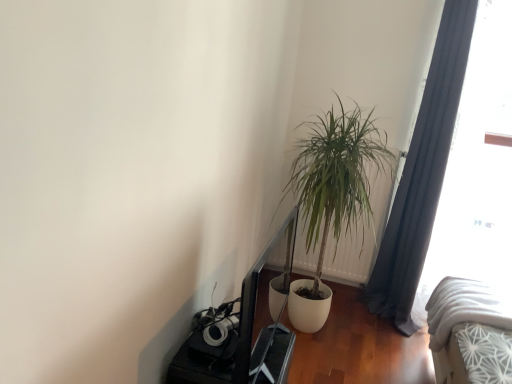
Question: Is dark gray fabric curtain at right positioned before transparent glass window at right?

Choices:
 (A) no
 (B) yes

Answer: (A)

Question: Considering the relative sizes of dark gray fabric curtain at right and transparent glass window at right in the image provided, is dark gray fabric curtain at right bigger than transparent glass window at right?

Choices:
 (A) yes
 (B) no

Answer: (B)

Question: Does dark gray fabric curtain at right have a smaller size compared to transparent glass window at right?

Choices:
 (A) no
 (B) yes

Answer: (B)

Question: Is dark gray fabric curtain at right completely or partially outside of transparent glass window at right?

Choices:
 (A) yes
 (B) no

Answer: (A)

Question: Is dark gray fabric curtain at right oriented away from transparent glass window at right?

Choices:
 (A) yes
 (B) no

Answer: (B)

Question: Could transparent glass window at right be considered to be inside dark gray fabric curtain at right?

Choices:
 (A) yes
 (B) no

Answer: (B)

Question: Does white plastic radiator at center-right have a greater height compared to white textured bed at lower right?

Choices:
 (A) no
 (B) yes

Answer: (B)

Question: From a real-world perspective, is white plastic radiator at center-right under white textured bed at lower right?

Choices:
 (A) yes
 (B) no

Answer: (B)

Question: From the image's perspective, would you say white plastic radiator at center-right is positioned over white textured bed at lower right?

Choices:
 (A) yes
 (B) no

Answer: (A)

Question: Is white plastic radiator at center-right touching white textured bed at lower right?

Choices:
 (A) no
 (B) yes

Answer: (A)

Question: From a real-world perspective, is white plastic radiator at center-right on top of white textured bed at lower right?

Choices:
 (A) no
 (B) yes

Answer: (B)

Question: Is white plastic radiator at center-right to the left of white textured bed at lower right from the viewer's perspective?

Choices:
 (A) no
 (B) yes

Answer: (B)

Question: From the image's perspective, is white plastic radiator at center-right located beneath transparent glass window at right?

Choices:
 (A) no
 (B) yes

Answer: (B)